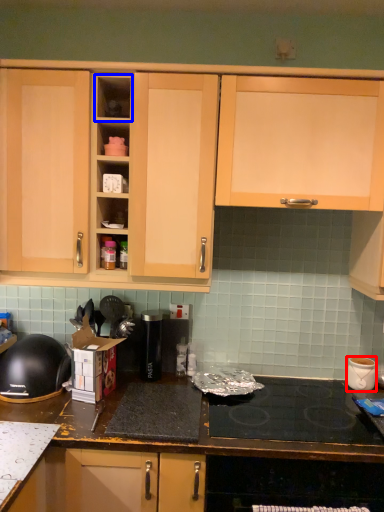
Question: Which of the following is the farthest to the observer, kitchen appliance (highlighted by a red box) or shelf (highlighted by a blue box)?

Choices:
 (A) kitchen appliance
 (B) shelf

Answer: (A)